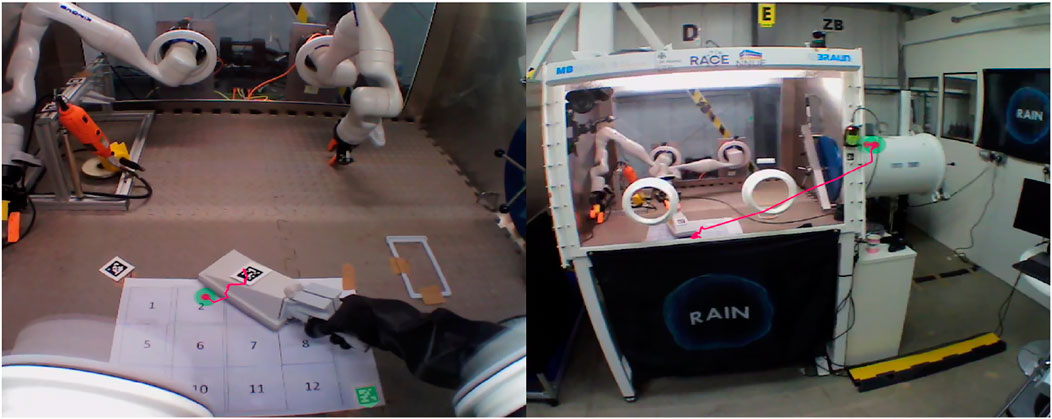
At what (x,y) coordinates should I click in order to perform the action: click on floor. Please return your answer as a coordinate pair (x, y). Looking at the image, I should click on (820, 400).